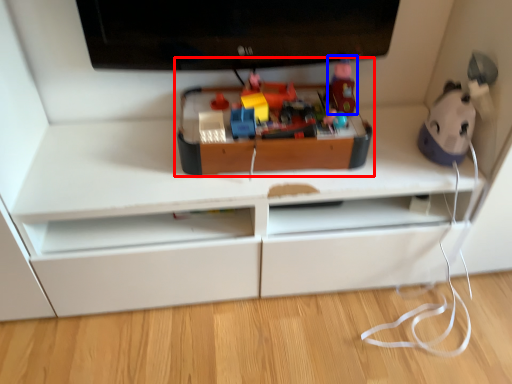
Question: Which object is further to the camera taking this photo, toy (highlighted by a red box) or toy (highlighted by a blue box)?

Choices:
 (A) toy
 (B) toy

Answer: (B)